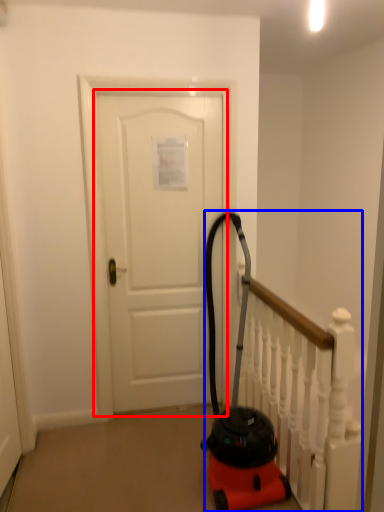
Question: Which point is further to the camera, door (highlighted by a red box) or rail (highlighted by a blue box)?

Choices:
 (A) door
 (B) rail

Answer: (A)